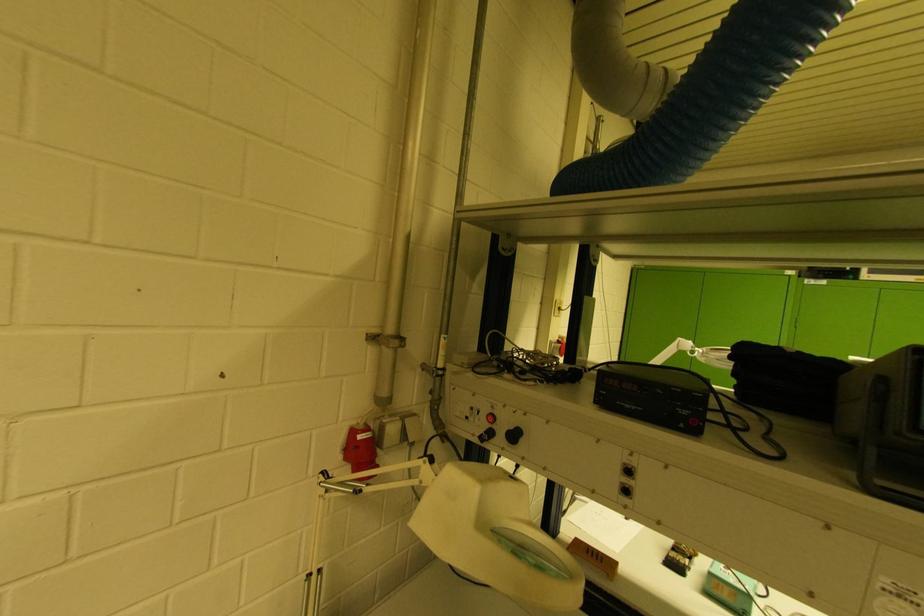
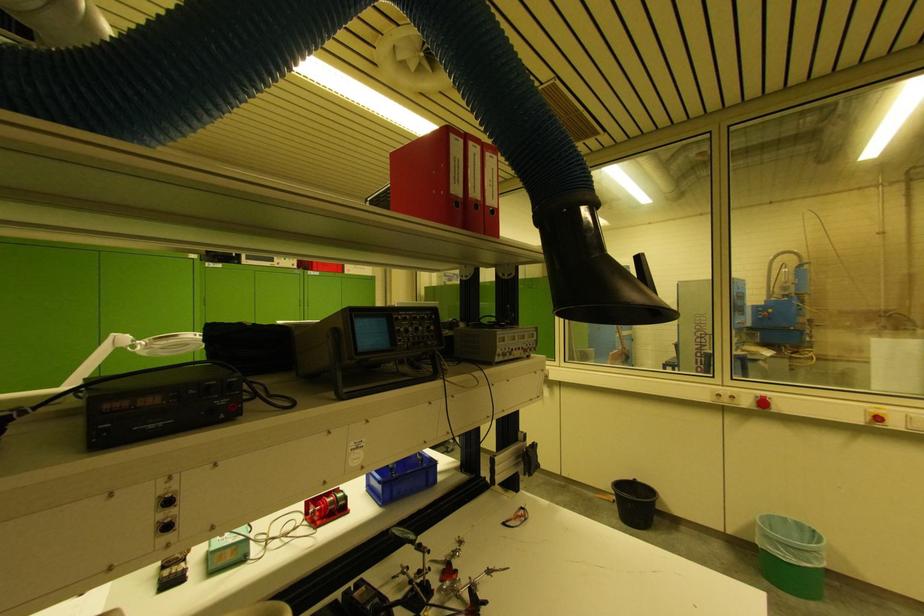
Question: The camera is either moving clockwise (left) or counter-clockwise (right) around the object. The first image is from the beginning of the video and the second image is from the end. Is the camera moving left or right when shooting the video?

Choices:
 (A) Left
 (B) Right

Answer: (A)